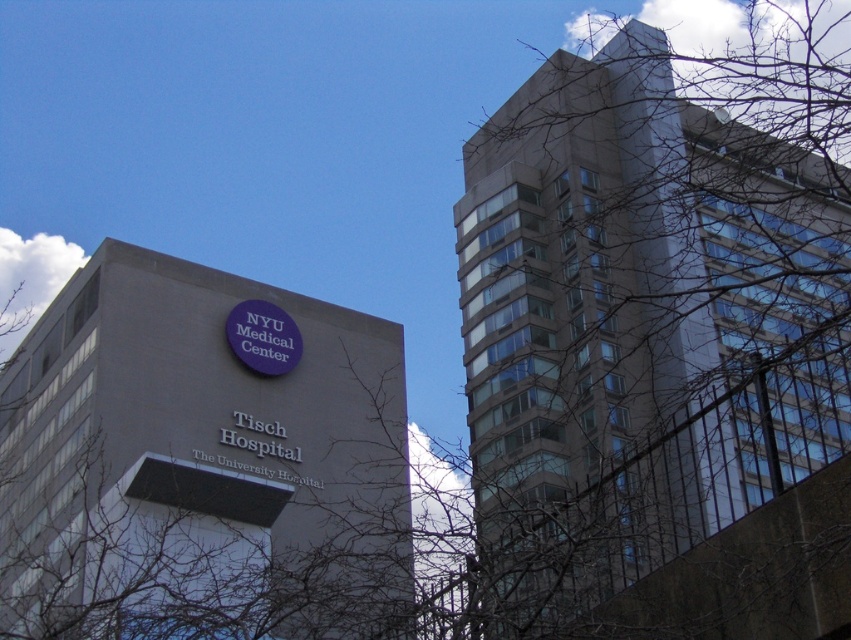
Can you confirm if bare branches at upper left is bigger than purple matte sign at center?

Yes.

Identify the location of bare branches at upper left. (638, 326).

Does point (570, 580) come farther from viewer compared to point (380, 620)?

No, it is in front of (380, 620).

Is bare branches at upper left bigger than gray concrete building at center?

Indeed, bare branches at upper left has a larger size compared to gray concrete building at center.

Locate an element on the screen. The width and height of the screenshot is (851, 640). bare branches at upper left is located at coordinates (638, 326).

Can you confirm if gray concrete building at center is thinner than purple matte sign at center?

No, gray concrete building at center is not thinner than purple matte sign at center.

Is point (294, 548) farther from viewer compared to point (278, 353)?

No, (294, 548) is in front of (278, 353).

Is point (187, 513) closer to camera compared to point (237, 324)?

Yes.

The height and width of the screenshot is (640, 851). I want to click on gray concrete building at center, so click(x=198, y=465).